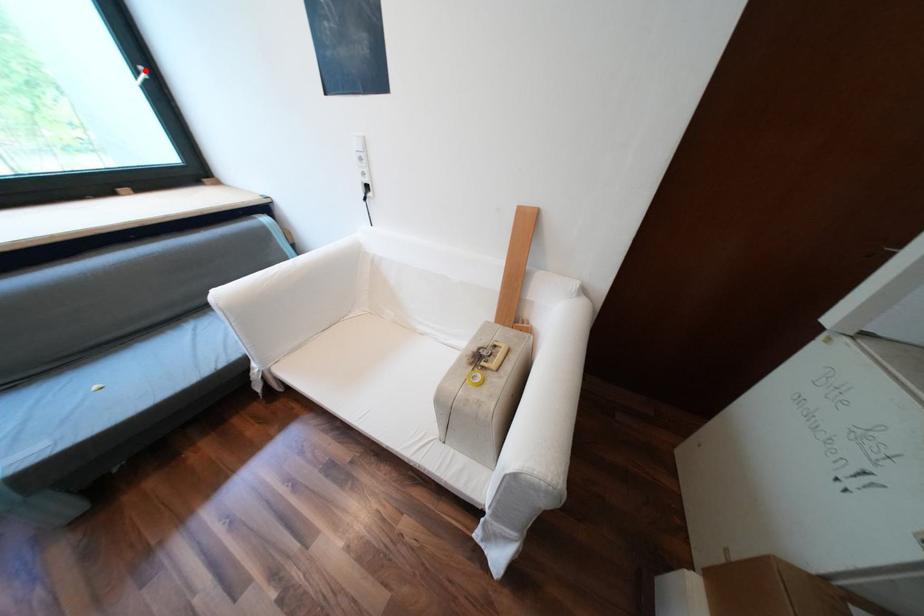
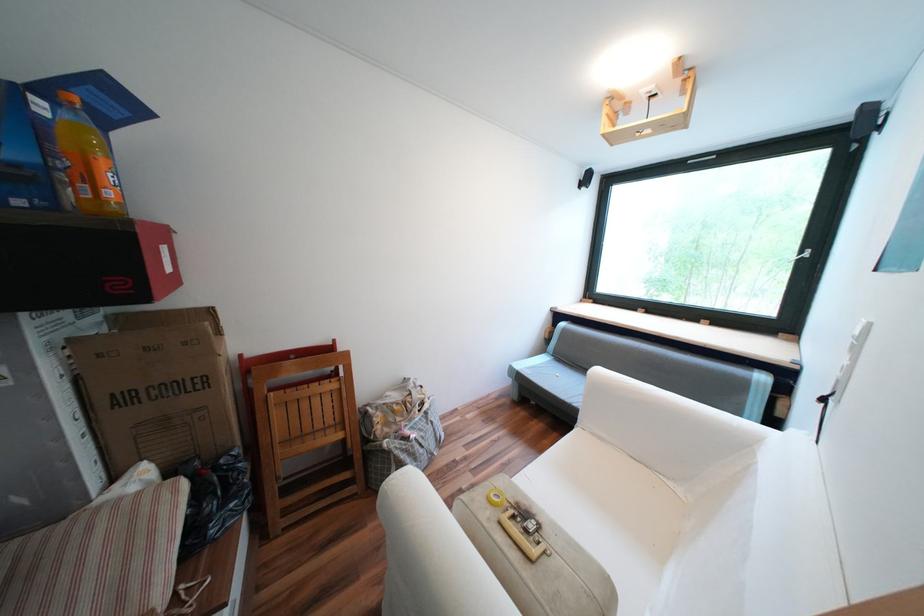
Where in the second image is the point corresponding to the highlighted location from the first image?

(809, 253)